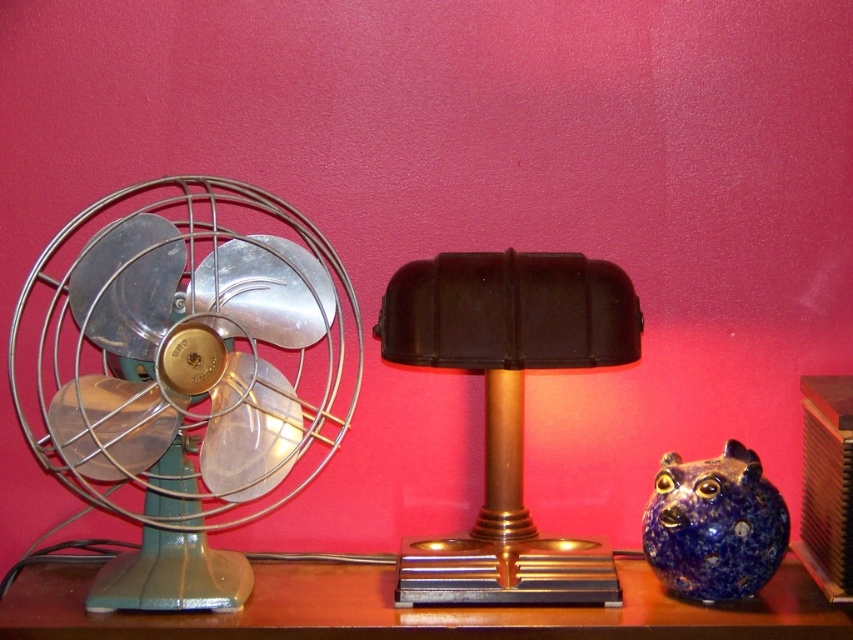
You are looking at the wooden surface with the vintage items. There are two points marked on the surface. The first point is at coordinates point (508, 387) and the second is at point (299, 566). Which point is nearer to you?

Point (508, 387) is closer to the viewer than point (299, 566).

You are arranging items on a shelf and need to place the metallic brown table at center and the blue speckled ceramic piggy bank at lower right. Based on their positions in the image, which object should you place closer to the front of the shelf?

→ The metallic brown table at center should be placed closer to the front of the shelf because it is in front of the blue speckled ceramic piggy bank at lower right in the image.

You are arranging items on a shelf and need to place the black plastic table lamp at center and the blue speckled ceramic piggy bank at lower right. According to the image, which item is positioned to the left when viewed from the front?

The black plastic table lamp at center is positioned to the left of the blue speckled ceramic piggy bank at lower right.